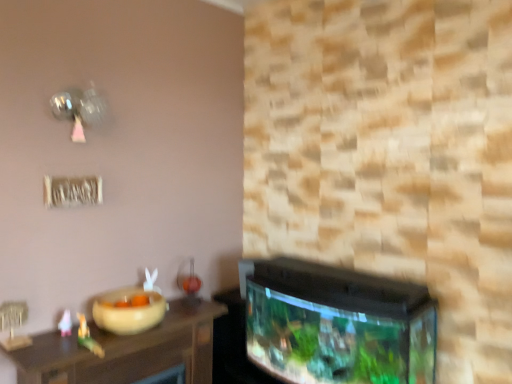
Question: Can you confirm if beige matte bowl at lower left is taller than matte green toy at left, which appears as the first toy when viewed from the front?

Choices:
 (A) yes
 (B) no

Answer: (B)

Question: From a real-world perspective, does beige matte bowl at lower left stand above matte green toy at left, which appears as the first toy when viewed from the front?

Choices:
 (A) no
 (B) yes

Answer: (B)

Question: Can you confirm if beige matte bowl at lower left is bigger than matte green toy at left, which is the 2th toy from left to right?

Choices:
 (A) no
 (B) yes

Answer: (B)

Question: Can you confirm if beige matte bowl at lower left is positioned to the left of matte green toy at left, which appears as the first toy when viewed from the front?

Choices:
 (A) no
 (B) yes

Answer: (A)

Question: Is beige matte bowl at lower left placed right next to matte green toy at left, which appears as the first toy when viewed from the front?

Choices:
 (A) no
 (B) yes

Answer: (A)

Question: From a real-world perspective, is pink paper airplane at lower left, which ranks as the 1th toy in back-to-front order, physically located above or below wooden table at lower left?

Choices:
 (A) below
 (B) above

Answer: (B)

Question: In terms of size, does pink paper airplane at lower left, which ranks as the 1th toy in back-to-front order, appear bigger or smaller than wooden table at lower left?

Choices:
 (A) big
 (B) small

Answer: (B)

Question: Does point (58, 327) appear closer or farther from the camera than point (101, 334)?

Choices:
 (A) farther
 (B) closer

Answer: (B)

Question: Would you say pink paper airplane at lower left, marked as the second toy in a front-to-back arrangement, is inside or outside wooden table at lower left?

Choices:
 (A) inside
 (B) outside

Answer: (B)

Question: In the image, is wooden table at lower left on the left side or the right side of matte green toy at left, which is the 2th toy from left to right?

Choices:
 (A) left
 (B) right

Answer: (B)

Question: From a real-world perspective, is wooden table at lower left physically located above or below matte green toy at left, acting as the 1th toy starting from the right?

Choices:
 (A) below
 (B) above

Answer: (A)

Question: From the image's perspective, is wooden table at lower left located above or below matte green toy at left, the 2th toy from the back?

Choices:
 (A) below
 (B) above

Answer: (A)

Question: Looking at their shapes, would you say wooden table at lower left is wider or thinner than matte green toy at left, the 2th toy from the back?

Choices:
 (A) wide
 (B) thin

Answer: (A)

Question: Based on their sizes in the image, would you say matte green toy at left, which appears as the first toy when viewed from the front, is bigger or smaller than beige matte bowl at lower left?

Choices:
 (A) small
 (B) big

Answer: (A)

Question: In the image, is matte green toy at left, which is the 2th toy from left to right, positioned in front of or behind beige matte bowl at lower left?

Choices:
 (A) front
 (B) behind

Answer: (A)